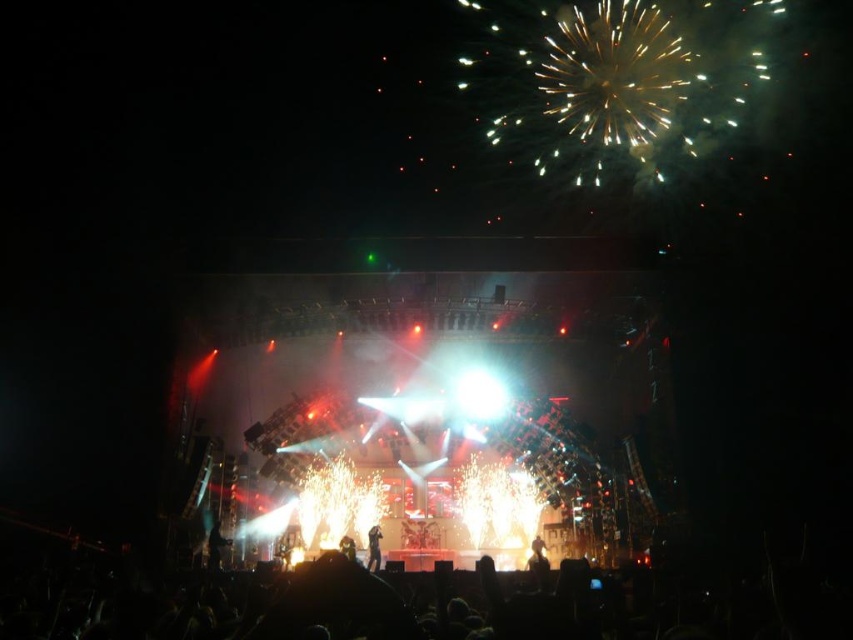
Question: Which of the following is the farthest from the observer?

Choices:
 (A) black matte crowd at lower center
 (B) metallic gold person at center

Answer: (B)

Question: Does black matte crowd at lower center lie behind shiny black suit at center?

Choices:
 (A) yes
 (B) no

Answer: (B)

Question: Is black matte crowd at lower center to the left of shiny black suit at center from the viewer's perspective?

Choices:
 (A) no
 (B) yes

Answer: (A)

Question: Which point is closer to the camera?

Choices:
 (A) (503, 612)
 (B) (527, 557)

Answer: (A)

Question: Is metallic gold person at center in front of shiny black suit at center?

Choices:
 (A) yes
 (B) no

Answer: (A)

Question: Estimate the real-world distances between objects in this image. Which object is closer to the black matte crowd at lower center?

Choices:
 (A) shiny black suit at center
 (B) metallic gold person at center

Answer: (B)